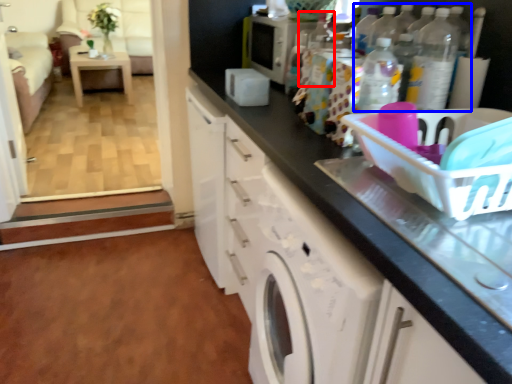
Question: Among these objects, which one is farthest to the camera, bottle (highlighted by a red box) or bottle (highlighted by a blue box)?

Choices:
 (A) bottle
 (B) bottle

Answer: (A)